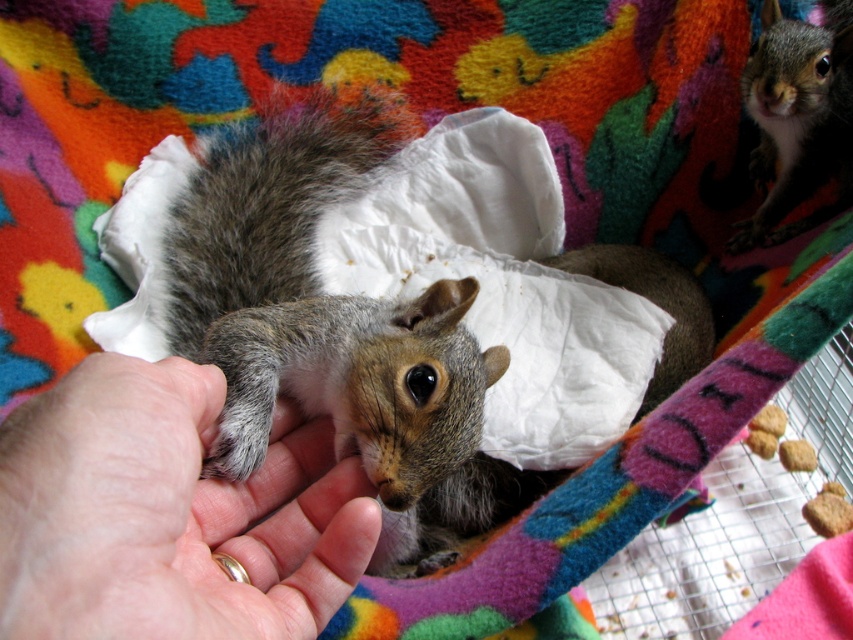
You are a wildlife rehabilitator assessing the size compatibility between the smooth skin hand at center and the gray fur squirrel at upper right. Based on their widths, can the squirrel be safely placed in the palm of the hand without falling through?

The smooth skin hand at center is wider than the gray fur squirrel at upper right, so the squirrel can be safely placed in the palm of the hand without falling through.

You are a photographer trying to capture the squirrel in the hand. You want to place a small sticker on the point that is closer to the camera. Which point should you choose between point (517, 497) and point (804, 154)?

Point (517, 497) is in front of point (804, 154), so you should place the sticker on point (517, 497) because it is closer to the camera.

You are looking at the image of a squirrel held by a hand. There are two points marked in the image. The first point is at coordinate point (218, 497) and the second is at point (815, 97). Which point is closer to you?

Point (218, 497) is closer to the camera than point (815, 97).